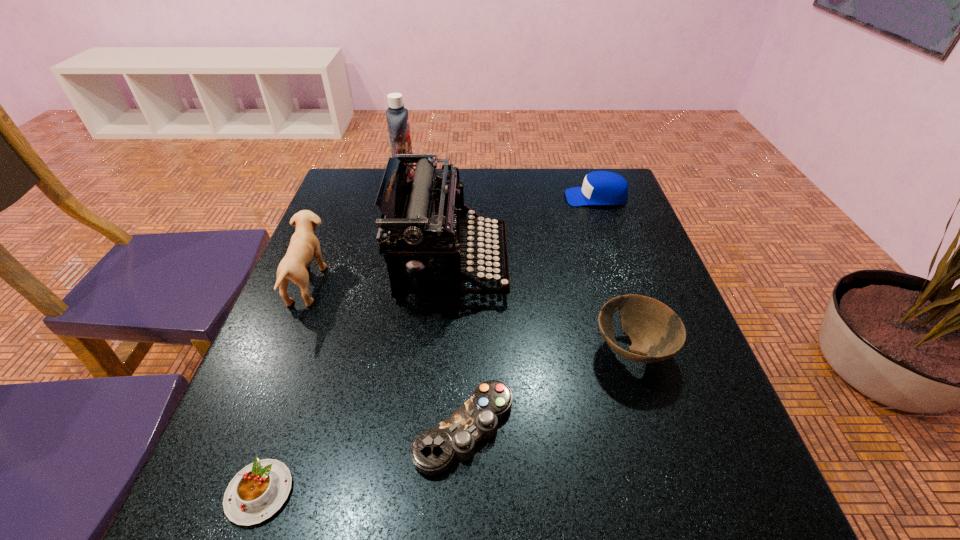
The height and width of the screenshot is (540, 960). What are the coordinates of `blank area located 0.140m on the front of the bowl` in the screenshot? It's located at (666, 458).

Locate an element on the screen. The image size is (960, 540). vacant point located 0.340m on the front-facing side of the baseball cap is located at coordinates (448, 197).

This screenshot has height=540, width=960. Identify the location of vacant space located on the front-facing side of the baseball cap. (472, 197).

At what (x,y) coordinates should I click in order to perform the action: click on vacant space situated 0.260m on the front-facing side of the baseball cap. Please return your answer as a coordinate pair (x, y). The height and width of the screenshot is (540, 960). Looking at the image, I should click on (476, 197).

Where is `vacant region located on the left of the control`? Image resolution: width=960 pixels, height=540 pixels. vacant region located on the left of the control is located at coordinates (386, 429).

This screenshot has width=960, height=540. In order to click on free space located on the right of the shortest object in this screenshot , I will do `click(396, 492)`.

Identify the location of shampoo at the far edge. This screenshot has height=540, width=960. (397, 117).

Find the location of `baseball cap at the far edge`. baseball cap at the far edge is located at coordinates (599, 187).

The height and width of the screenshot is (540, 960). Identify the location of control that is at the near edge. (433, 451).

Image resolution: width=960 pixels, height=540 pixels. What are the coordinates of `pudding that is at the near edge` in the screenshot? It's located at (258, 491).